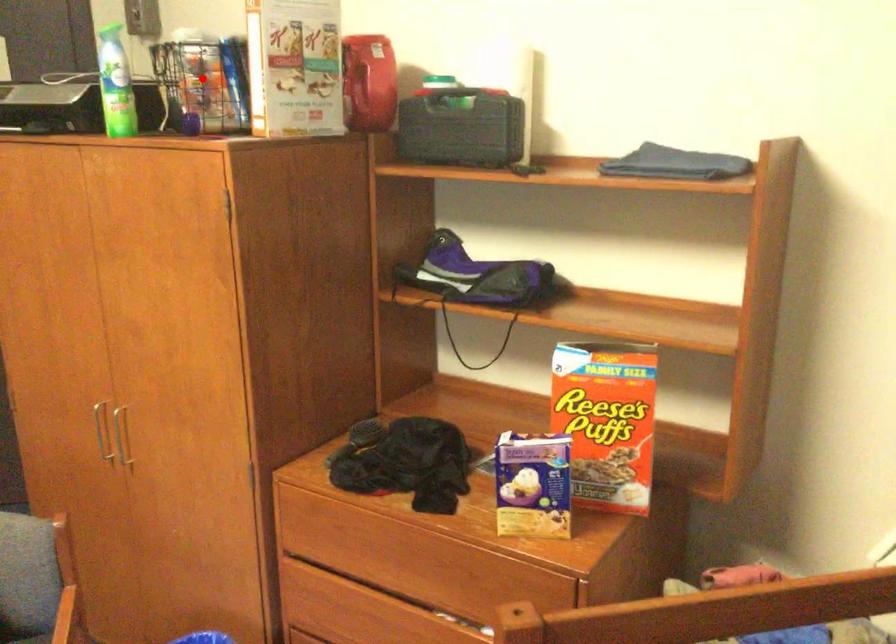
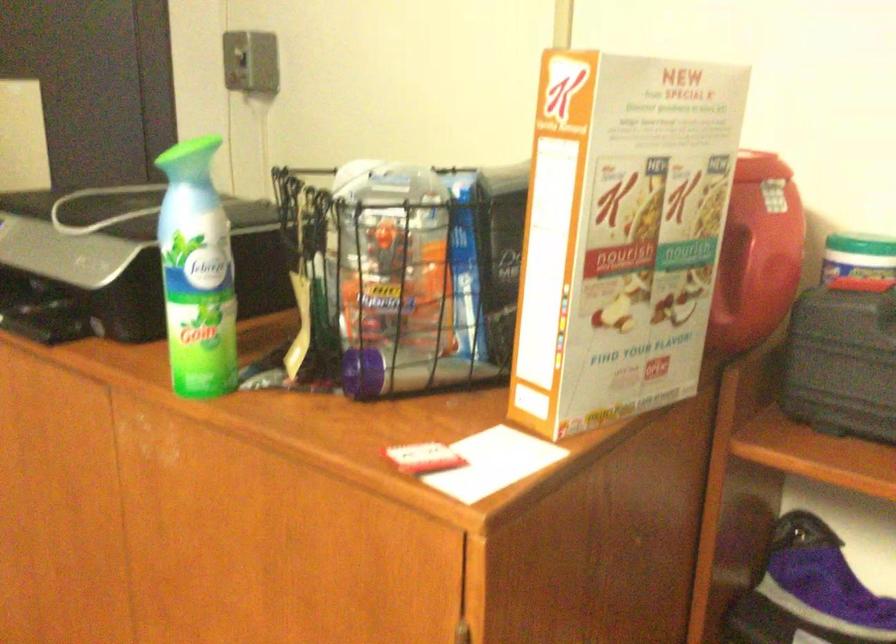
The point at the highlighted location is marked in the first image. Where is the corresponding point in the second image?

(401, 275)